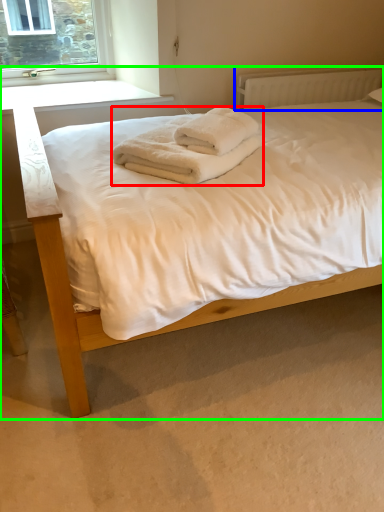
Question: Which is farther away from bath towel (highlighted by a red box)? radiator (highlighted by a blue box) or bed (highlighted by a green box)?

Choices:
 (A) radiator
 (B) bed

Answer: (A)